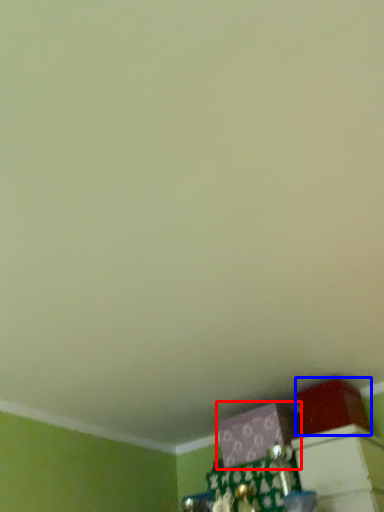
Question: Which of the following is the farthest to the observer, box (highlighted by a red box) or box (highlighted by a blue box)?

Choices:
 (A) box
 (B) box

Answer: (A)